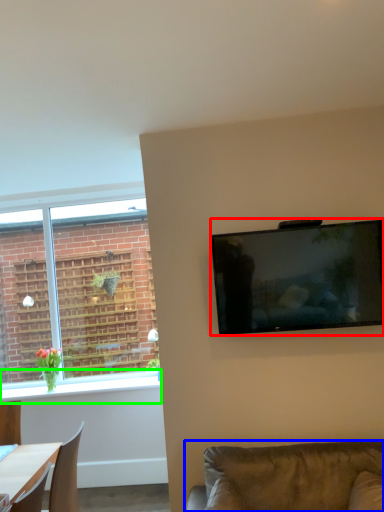
Question: Which object is positioned farthest from television (highlighted by a red box)? Select from studio couch (highlighted by a blue box) and window sill (highlighted by a green box).

Choices:
 (A) studio couch
 (B) window sill

Answer: (B)